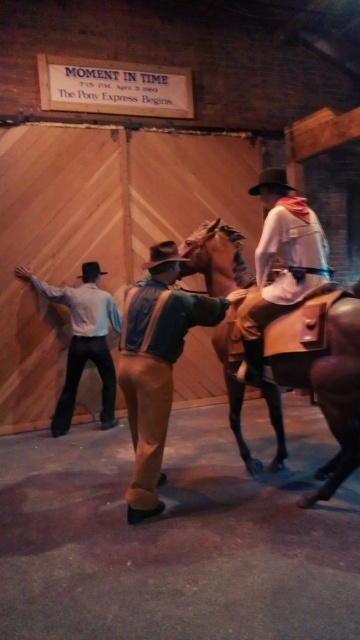
You are a photographer at the Pony Express reenactment. You need to take a photo of the leather jacket at center and the light blue shirt at left. Which one should you focus on first to ensure it appears clearer in the photo?

The leather jacket at center should be focused on first because it is in front of the light blue shirt at left, so focusing on it will keep it clearer while the background may blur slightly.

You are a photographer at the historical reenactment. You need to capture a photo of the denim jacket at center and light blue shirt at left. Which one is lower in the photo?

The denim jacket at center is positioned under the light blue shirt at left, so the denim jacket at center is lower in the photo.